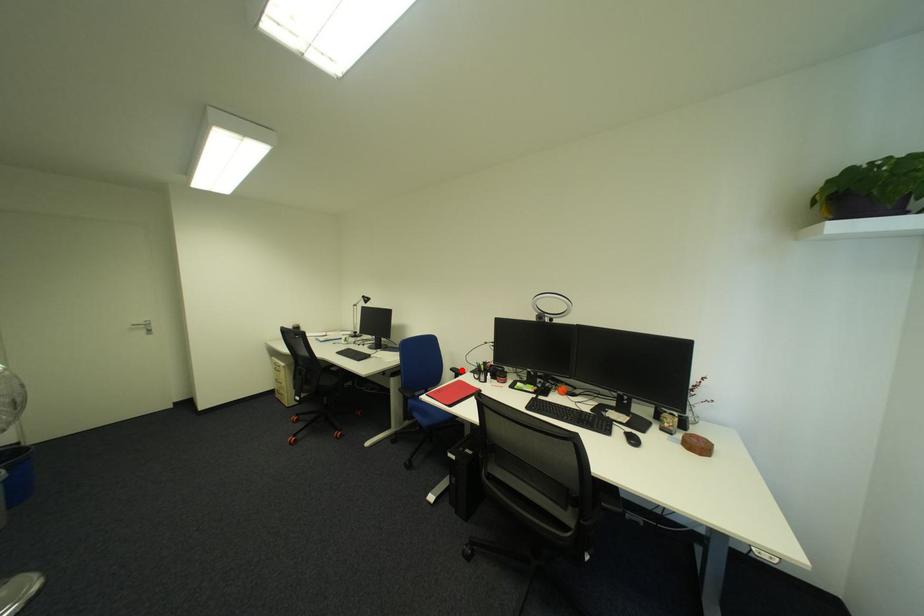
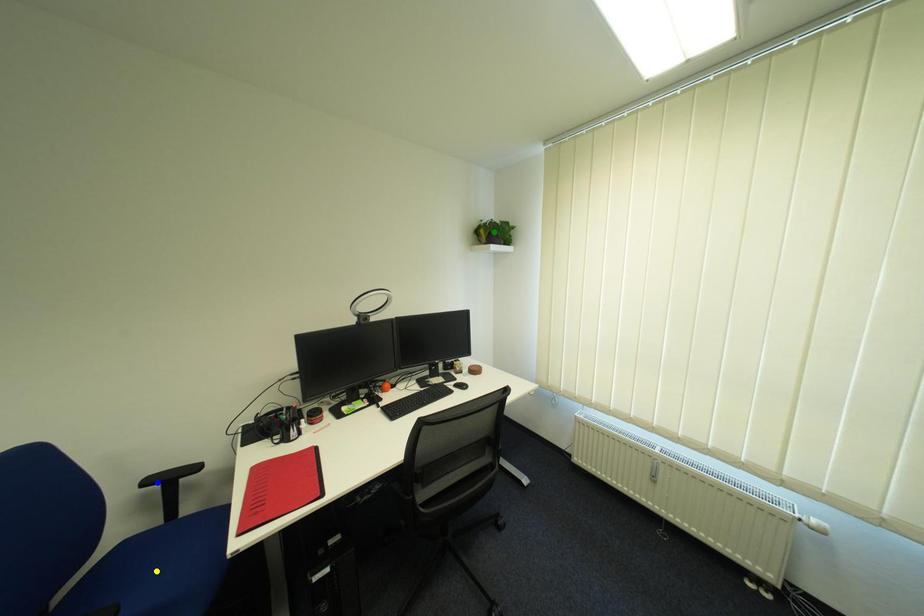
Question: I am providing you with two images of the same scene from different viewpoints. A red point is marked on the first image. You are given multiple points on the second image. Can you choose the point in image 2 that corresponds to the point in image 1?

Choices:
 (A) blue point
 (B) yellow point
 (C) green point

Answer: (A)